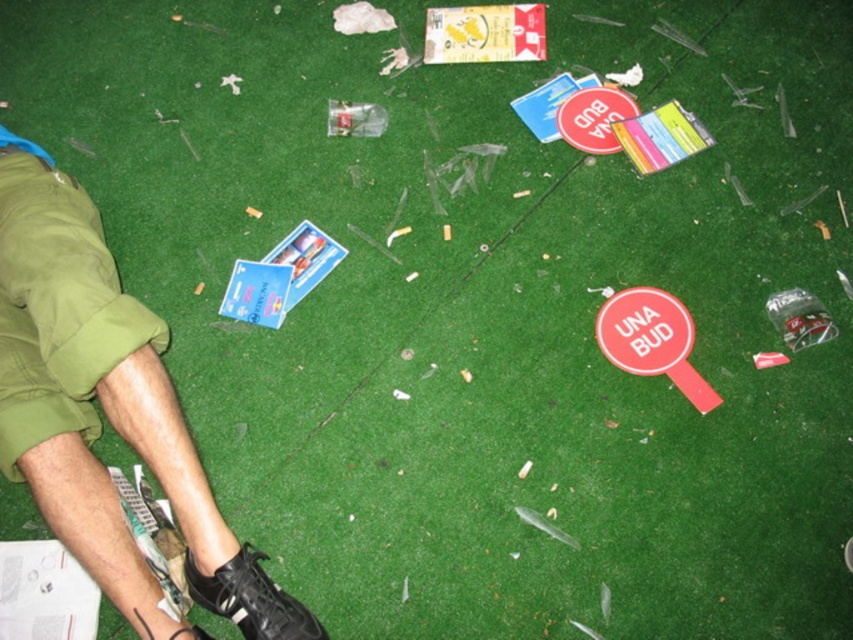
Question: Which point is closer to the camera taking this photo?

Choices:
 (A) (209, 637)
 (B) (207, 580)

Answer: (B)

Question: Is green cotton shorts at lower left thinner than red plastic sign at lower right?

Choices:
 (A) no
 (B) yes

Answer: (A)

Question: Does black leather shoe at lower left have a greater width compared to red plastic sign at lower right?

Choices:
 (A) yes
 (B) no

Answer: (A)

Question: Can you confirm if green cotton shorts at lower left is positioned above red plastic sign at lower right?

Choices:
 (A) no
 (B) yes

Answer: (A)

Question: Which point is closer to the camera?

Choices:
 (A) green cotton shorts at lower left
 (B) black leather shoe at lower center
 (C) black leather shoe at lower left
 (D) red plastic sign at lower right

Answer: (C)

Question: Which point is closer to the camera?

Choices:
 (A) (x=288, y=634)
 (B) (x=625, y=352)

Answer: (A)